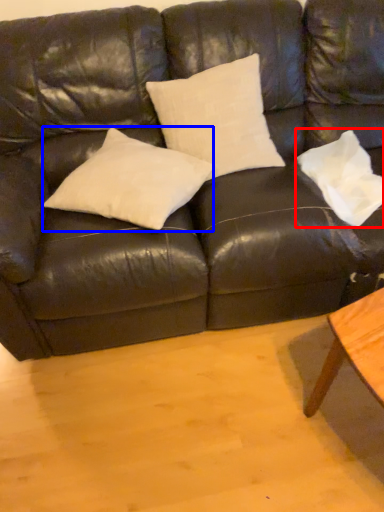
Question: Which object is closer to the camera taking this photo, pillow (highlighted by a red box) or pillow (highlighted by a blue box)?

Choices:
 (A) pillow
 (B) pillow

Answer: (B)